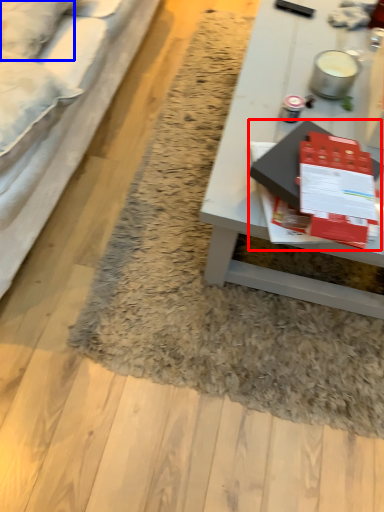
Question: Among these objects, which one is nearest to the camera, magazine (highlighted by a red box) or pillow (highlighted by a blue box)?

Choices:
 (A) magazine
 (B) pillow

Answer: (A)